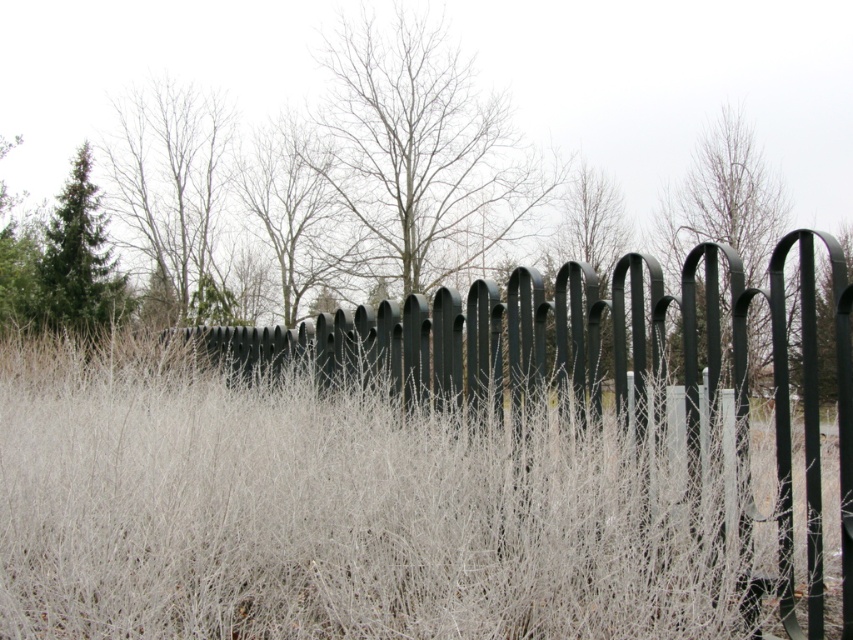
Is point (202, 321) closer to viewer compared to point (724, 122)?

Yes, point (202, 321) is closer to viewer.

What are the coordinates of `smooth bark tree at upper left` in the screenshot? It's located at (171, 193).

Is white frosted grass at center to the left of green matte evergreen tree at upper left from the viewer's perspective?

In fact, white frosted grass at center is to the right of green matte evergreen tree at upper left.

Does white frosted grass at center appear under green matte evergreen tree at upper left?

Indeed, white frosted grass at center is positioned under green matte evergreen tree at upper left.

I want to click on white frosted grass at center, so click(329, 512).

The image size is (853, 640). Find the location of `white frosted grass at center`. white frosted grass at center is located at coordinates (329, 512).

Is green matte tree at upper right shorter than green matte evergreen tree at upper left?

Correct, green matte tree at upper right is not as tall as green matte evergreen tree at upper left.

Who is shorter, green matte tree at upper right or green matte evergreen tree at upper left?

Standing shorter between the two is green matte tree at upper right.

What do you see at coordinates (723, 202) in the screenshot?
I see `green matte tree at upper right` at bounding box center [723, 202].

This screenshot has width=853, height=640. Identify the location of green matte tree at upper right. (723, 202).